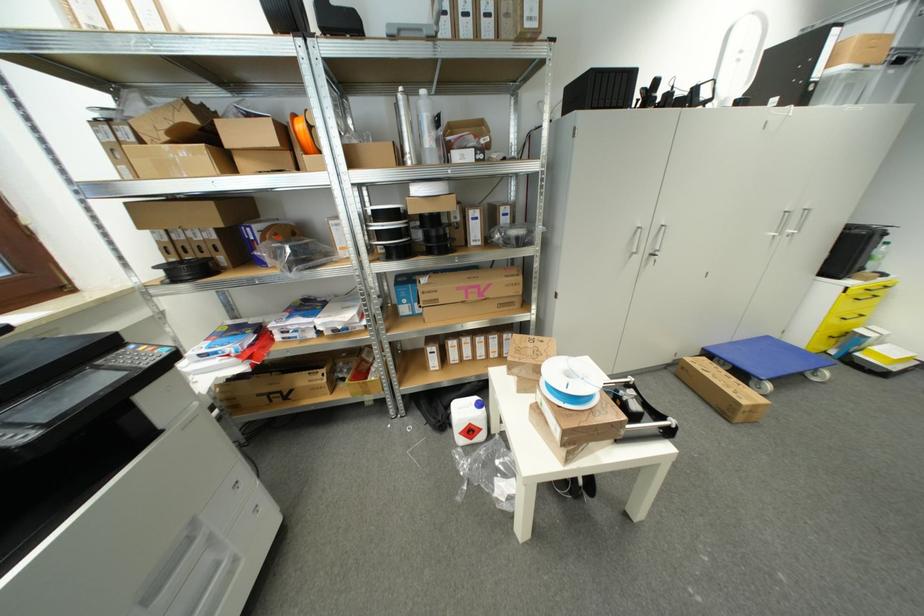
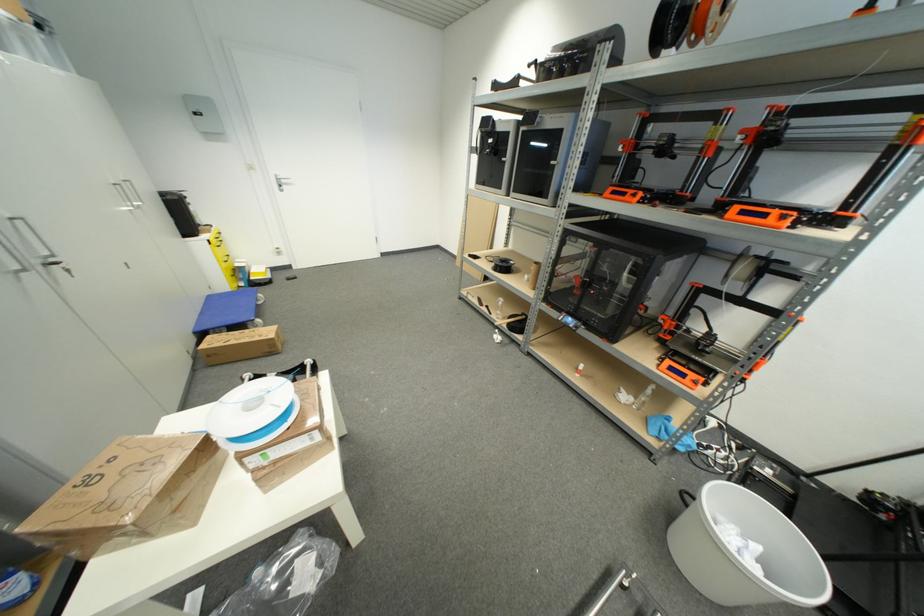
In the second image, find the point that corresponds to (x=655, y=254) in the first image.

(43, 264)